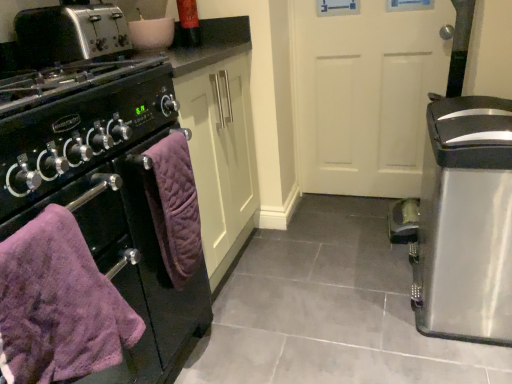
Question: Looking at their shapes, would you say silver metallic toaster at upper left is wider or thinner than satin silver trash can at right?

Choices:
 (A) thin
 (B) wide

Answer: (A)

Question: From a real-world perspective, is silver metallic toaster at upper left physically located above or below satin silver trash can at right?

Choices:
 (A) below
 (B) above

Answer: (B)

Question: Estimate the real-world distances between objects in this image. Which object is closer to the purple quilted towel at lower left, the 1th bath towel when ordered from back to front?

Choices:
 (A) matte black oven at left
 (B) silver metallic toaster at upper left
 (C) satin silver trash can at right
 (D) purple quilted towel at left, arranged as the second bath towel when viewed from the back
 (E) white matte door at center

Answer: (A)

Question: Which object is the farthest from the satin silver trash can at right?

Choices:
 (A) purple quilted towel at left, the first bath towel in the front-to-back sequence
 (B) white matte door at center
 (C) silver metallic toaster at upper left
 (D) matte black oven at left
 (E) purple quilted towel at lower left, the 1th bath towel when ordered from back to front

Answer: (C)